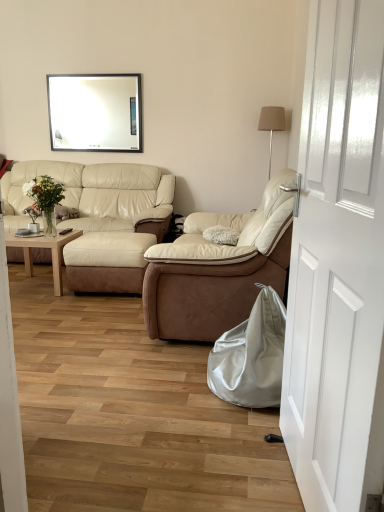
This screenshot has width=384, height=512. In order to click on free spot in front of beige suede footrest at center in this screenshot , I will do `click(89, 308)`.